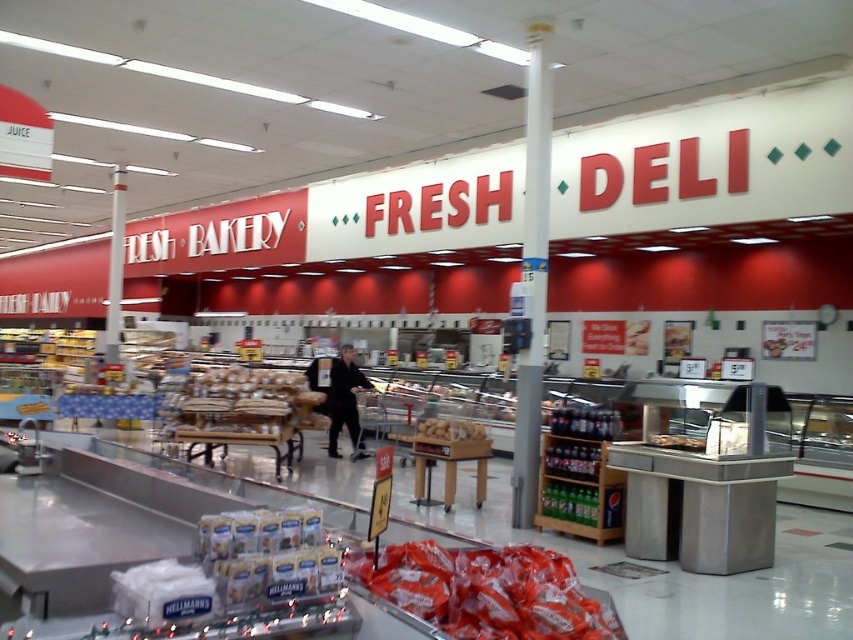
Question: Which point appears farthest from the camera in this image?

Choices:
 (A) (479, 435)
 (B) (341, 364)

Answer: (B)

Question: Does matte plastic bags of chips at center have a larger size compared to translucent plastic bag at center?

Choices:
 (A) yes
 (B) no

Answer: (A)

Question: Which point is farther from the camera taking this photo?

Choices:
 (A) (437, 432)
 (B) (469, 552)
 (C) (204, 372)

Answer: (C)

Question: Which point appears closest to the camera in this image?

Choices:
 (A) (576, 616)
 (B) (689, 442)

Answer: (A)

Question: Does dark gray fabric jacket at center appear on the left side of translucent plastic bag at center?

Choices:
 (A) yes
 (B) no

Answer: (A)

Question: Is bread matte at center below smooth brown bread at center?

Choices:
 (A) no
 (B) yes

Answer: (A)